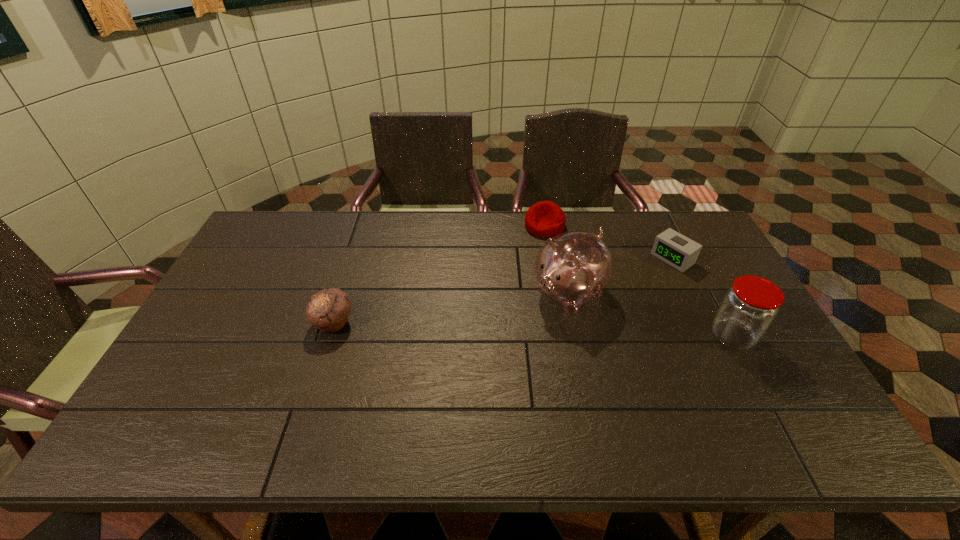
I want to click on alarm clock that is at the right edge, so click(x=675, y=249).

You are a GUI agent. You are given a task and a screenshot of the screen. Output one action in this format:
    pyautogui.click(x=<x>, y=<y>)
    Task: Click on the object located in the far right corner section of the desktop
    This screenshot has height=540, width=960.
    Given the screenshot: What is the action you would take?
    pyautogui.click(x=675, y=249)

Find the location of a particular element. This screenshot has width=960, height=540. free region at the far edge of the desktop is located at coordinates (516, 236).

This screenshot has width=960, height=540. In the image, there is a desktop. What are the coordinates of `vacant space at the near edge` in the screenshot? It's located at (634, 410).

What are the coordinates of `vacant space at the left edge of the desktop` in the screenshot? It's located at click(244, 265).

Locate an element on the screen. The image size is (960, 540). vacant area at the right edge is located at coordinates (773, 356).

Where is `vacant space at the near right corner of the desktop`? This screenshot has height=540, width=960. vacant space at the near right corner of the desktop is located at coordinates (747, 403).

Find the location of a particular element. vacant area between the leftmost object and the alarm clock is located at coordinates (503, 291).

The image size is (960, 540). Identify the location of free area in between the leftmost object and the alarm clock. (503, 291).

Locate an element on the screen. The width and height of the screenshot is (960, 540). free spot between the farthest object and the third shortest object is located at coordinates (x=439, y=274).